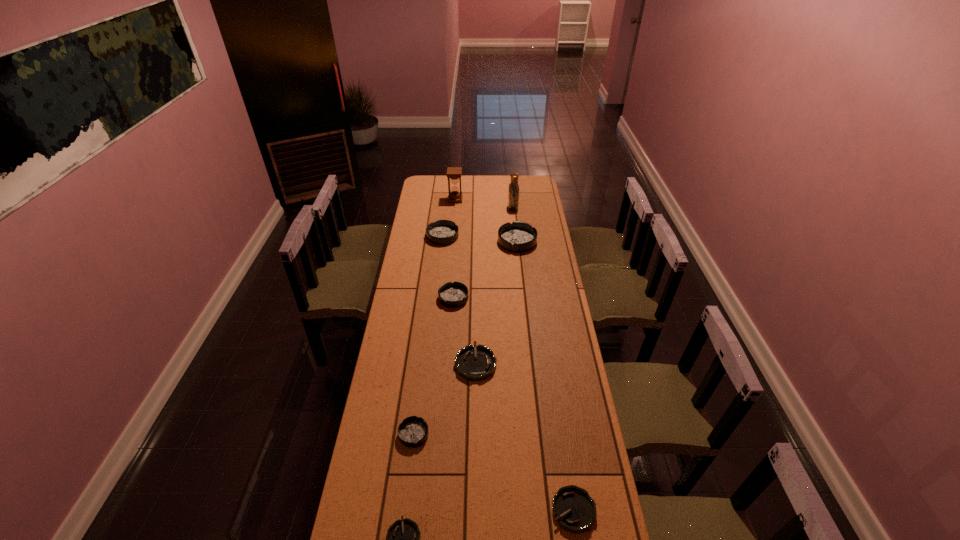
What are the coordinates of `the fifth farthest ashtray` in the screenshot? It's located at [x=413, y=431].

Image resolution: width=960 pixels, height=540 pixels. I want to click on the seventh farthest object, so click(413, 431).

This screenshot has height=540, width=960. Find the location of `the second smallest green ashtray`. the second smallest green ashtray is located at coordinates (574, 510).

Locate an element on the screen. The height and width of the screenshot is (540, 960). the second shortest object is located at coordinates (574, 510).

Find the location of a particular element. This screenshot has height=540, width=960. free space located 0.270m on the front-facing side of the second farthest object is located at coordinates 464,208.

Locate an element on the screen. vacant area situated on the front-facing side of the second farthest object is located at coordinates (467, 208).

What are the coordinates of `free spot located 0.190m on the front-facing side of the second farthest object` in the screenshot? It's located at (476, 208).

Locate an element on the screen. Image resolution: width=960 pixels, height=540 pixels. free location located on the right of the hourglass is located at coordinates (483, 200).

Locate an element on the screen. The height and width of the screenshot is (540, 960). free space located on the front of the biggest dark ashtray is located at coordinates (521, 278).

Where is `free space located 0.170m on the front of the second tallest ashtray`? Image resolution: width=960 pixels, height=540 pixels. free space located 0.170m on the front of the second tallest ashtray is located at coordinates (440, 265).